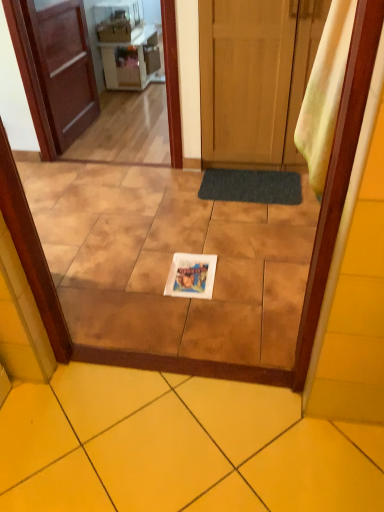
Question: Choose the correct answer: Is brown wooden door at left, which appears as the first door when viewed from the left, inside brown wooden screen door at upper left or outside it?

Choices:
 (A) inside
 (B) outside

Answer: (B)

Question: In the image, is brown wooden door at left, which is the second door from right to left, positioned in front of or behind brown wooden screen door at upper left?

Choices:
 (A) behind
 (B) front

Answer: (A)

Question: Estimate the real-world distances between objects in this image. Which object is closer to the yellow ceramic tile at center, positioned as the 2th ceramic tile in back-to-front order?

Choices:
 (A) matte white vanity at upper center
 (B) dark gray textured bath mat at center
 (C) yellow fabric curtain at right
 (D) metallic silver microwave at upper center, which appears as the second appliance when viewed from the front
 (E) brown wooden screen door at upper left

Answer: (C)

Question: Estimate the real-world distances between objects in this image. Which object is closer to the yellow fabric curtain at right?

Choices:
 (A) brown wooden door at left, which is the second door from right to left
 (B) wooden door at center, the 2th door viewed from the left
 (C) matte white microwave at upper center, positioned as the first appliance in left-to-right order
 (D) dark gray textured bath mat at center
 (E) matte white vanity at upper center

Answer: (D)